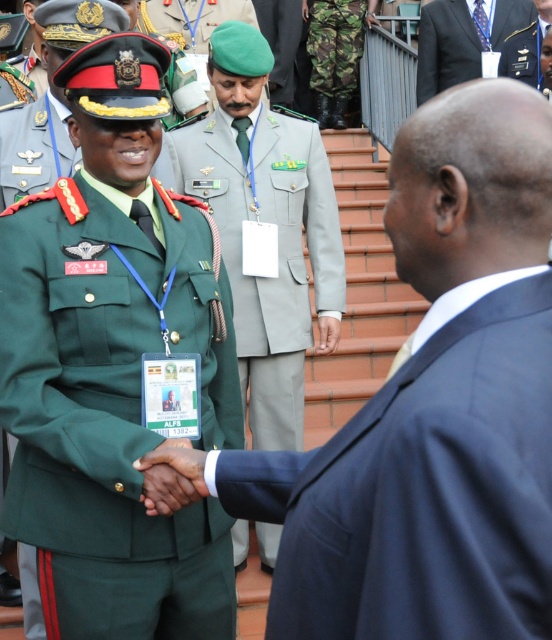
Question: Which point is farther to the camera?

Choices:
 (A) dark blue suit at upper right
 (B) green matte uniform at center
 (C) green uniform at left

Answer: (A)

Question: Is green matte uniform at center thinner than green military uniform at center?

Choices:
 (A) no
 (B) yes

Answer: (A)

Question: Is green matte uniform at center above dark blue suit at upper right?

Choices:
 (A) no
 (B) yes

Answer: (A)

Question: Does green uniform at left appear over green military uniform at center?

Choices:
 (A) no
 (B) yes

Answer: (A)

Question: Based on their relative distances, which object is farther from the dark blue suit at upper right?

Choices:
 (A) green fabric uniform at center
 (B) green military uniform at center

Answer: (A)

Question: Based on their relative distances, which object is farther from the green uniform at left?

Choices:
 (A) green matte uniform at center
 (B) green military uniform at center
 (C) green fabric uniform at center

Answer: (B)